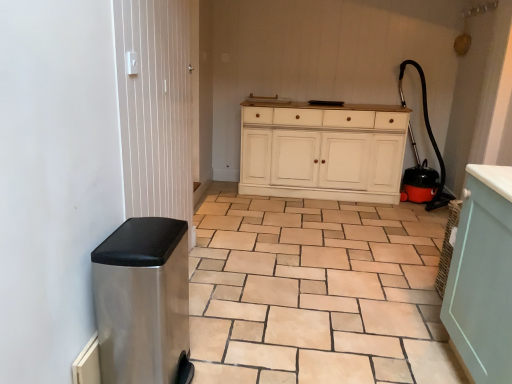
What do you see at coordinates (323, 151) in the screenshot? This screenshot has width=512, height=384. I see `white painted wood cabinet at center` at bounding box center [323, 151].

The image size is (512, 384). I want to click on white painted wood cabinet at center, so click(x=323, y=151).

The height and width of the screenshot is (384, 512). What are the coordinates of `white painted wood cabinet at center` in the screenshot? It's located at (323, 151).

Is slate gray ceramic tile at lower left at the back of white painted wood cabinet at center?

No, white painted wood cabinet at center's orientation is not away from slate gray ceramic tile at lower left.

From a real-world perspective, which object stands above the other?

From a 3D spatial view, white painted wood cabinet at center is above.

Is white painted wood cabinet at center not within slate gray ceramic tile at lower left?

Absolutely, white painted wood cabinet at center is external to slate gray ceramic tile at lower left.

Is metallic silver screen door at left directly adjacent to white painted wood cabinet at center?

No, metallic silver screen door at left is not touching white painted wood cabinet at center.

Which is in front, point (185, 123) or point (262, 189)?

Point (185, 123)

Can you confirm if metallic silver screen door at left is bigger than white painted wood cabinet at center?

No, metallic silver screen door at left is not bigger than white painted wood cabinet at center.

Considering the points (400, 112) and (157, 157), which point is in front, point (400, 112) or point (157, 157)?

Positioned in front is point (157, 157).

You are a GUI agent. You are given a task and a screenshot of the screen. Output one action in this format:
    pyautogui.click(x=<x>, y=<y>)
    Task: Click on the screen door positioned vertically above the white painted wood cabinet at center (from a real-world perspective)
    
    Given the screenshot: What is the action you would take?
    pyautogui.click(x=155, y=108)

From a real-world perspective, is white painted wood cabinet at center above or below metallic silver screen door at left?

From a real-world perspective, white painted wood cabinet at center is physically below metallic silver screen door at left.

Is white painted wood cabinet at center located outside metallic silver screen door at left?

Indeed, white painted wood cabinet at center is completely outside metallic silver screen door at left.

Which object is positioned more to the right, metallic silver screen door at left or slate gray ceramic tile at lower left?

slate gray ceramic tile at lower left is more to the right.

From the image's perspective, is metallic silver screen door at left above or below slate gray ceramic tile at lower left?

Based on their image positions, metallic silver screen door at left is located above slate gray ceramic tile at lower left.

Measure the distance from metallic silver screen door at left to slate gray ceramic tile at lower left.

metallic silver screen door at left is 1.07 meters from slate gray ceramic tile at lower left.

Which is behind, point (124, 30) or point (322, 312)?

The point (322, 312) is more distant.

Between stainless steel trash can at left and white painted wood cabinet at center, which one appears on the left side from the viewer's perspective?

From the viewer's perspective, stainless steel trash can at left appears more on the left side.

Based on the photo, which object is further away from the camera taking this photo, stainless steel trash can at left or white painted wood cabinet at center?

white painted wood cabinet at center is further away from the camera.

Is stainless steel trash can at left bigger than white painted wood cabinet at center?

No, stainless steel trash can at left is not bigger than white painted wood cabinet at center.

Could you tell me if stainless steel trash can at left is facing white painted wood cabinet at center?

No.

Is the surface of metallic silver screen door at left in direct contact with stainless steel trash can at left?

No, metallic silver screen door at left is not beside stainless steel trash can at left.

How far apart are metallic silver screen door at left and stainless steel trash can at left?

metallic silver screen door at left is 22.98 inches away from stainless steel trash can at left.

Does point (168, 209) come farther from viewer compared to point (121, 325)?

Yes, point (168, 209) is behind point (121, 325).

Between metallic silver screen door at left and stainless steel trash can at left, which one has smaller size?

Smaller between the two is metallic silver screen door at left.

Considering the positions of objects white painted wood cabinet at center and stainless steel trash can at left in the image provided, who is more to the left, white painted wood cabinet at center or stainless steel trash can at left?

Positioned to the left is stainless steel trash can at left.

Does point (288, 171) come closer to viewer compared to point (129, 231)?

That is False.

From the image's perspective, which object appears higher, white painted wood cabinet at center or stainless steel trash can at left?

white painted wood cabinet at center appears higher in the image.

Is white painted wood cabinet at center wider than stainless steel trash can at left?

Indeed, white painted wood cabinet at center has a greater width compared to stainless steel trash can at left.

Where is `ceramic tile that is under the white painted wood cabinet at center (from a real-world perspective)`? ceramic tile that is under the white painted wood cabinet at center (from a real-world perspective) is located at coordinates [x=316, y=292].

Locate an element on the screen. This screenshot has width=512, height=384. screen door on the left of white painted wood cabinet at center is located at coordinates (155, 108).

Which object lies nearer to the anchor point white painted wood cabinet at center, metallic silver screen door at left or stainless steel trash can at left?

Among the two, metallic silver screen door at left is located nearer to white painted wood cabinet at center.

Considering their positions, is metallic silver screen door at left positioned closer to stainless steel trash can at left than slate gray ceramic tile at lower left?

metallic silver screen door at left is closer to stainless steel trash can at left.

Estimate the real-world distances between objects in this image. Which object is further from slate gray ceramic tile at lower left, white painted wood cabinet at center or stainless steel trash can at left?

white painted wood cabinet at center lies further to slate gray ceramic tile at lower left than the other object.

When comparing their distances from metallic silver screen door at left, does stainless steel trash can at left or slate gray ceramic tile at lower left seem closer?

stainless steel trash can at left lies closer to metallic silver screen door at left than the other object.

From the picture: Which object lies further to the anchor point metallic silver screen door at left, slate gray ceramic tile at lower left or white painted wood cabinet at center?

white painted wood cabinet at center is positioned further to the anchor metallic silver screen door at left.

Estimate the real-world distances between objects in this image. Which object is further from stainless steel trash can at left, white painted wood cabinet at center or slate gray ceramic tile at lower left?

white painted wood cabinet at center lies further to stainless steel trash can at left than the other object.

When comparing their distances from metallic silver screen door at left, does white painted wood cabinet at center or slate gray ceramic tile at lower left seem further?

white painted wood cabinet at center is further to metallic silver screen door at left.

Considering their positions, is slate gray ceramic tile at lower left positioned closer to stainless steel trash can at left than white painted wood cabinet at center?

slate gray ceramic tile at lower left is positioned closer to the anchor stainless steel trash can at left.

Locate an element on the screen. The height and width of the screenshot is (384, 512). ceramic tile between stainless steel trash can at left and white painted wood cabinet at center from front to back is located at coordinates (316, 292).

Image resolution: width=512 pixels, height=384 pixels. What are the coordinates of `water heater between metallic silver screen door at left and slate gray ceramic tile at lower left from left to right` in the screenshot? It's located at pos(143,302).

Find the location of a particular element. screen door between stainless steel trash can at left and white painted wood cabinet at center in the front-back direction is located at coordinates (155, 108).

Locate an element on the screen. ceramic tile positioned between metallic silver screen door at left and white painted wood cabinet at center from near to far is located at coordinates (316, 292).